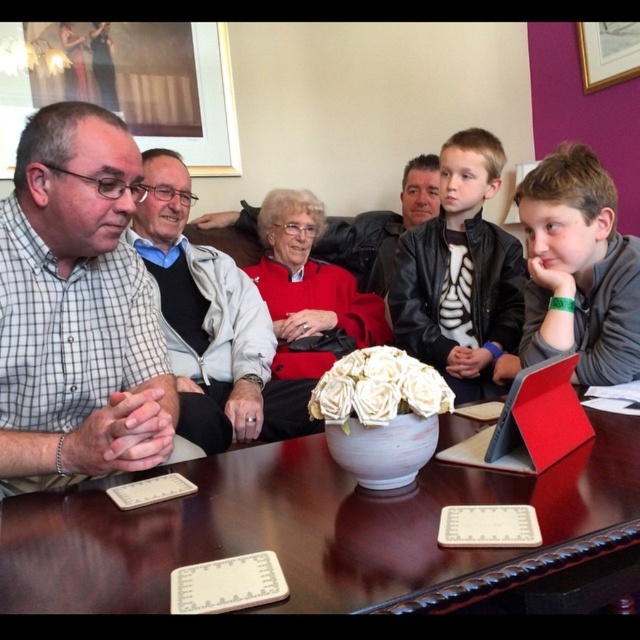
Question: Which point is farther from the camera taking this photo?

Choices:
 (A) (106, 420)
 (B) (572, 264)
 (C) (211, 324)

Answer: (C)

Question: Can you confirm if matte black laptop at center is positioned below matte black jacket at center?

Choices:
 (A) yes
 (B) no

Answer: (A)

Question: Can you confirm if checkered fabric shirt at left is bigger than matte black jacket at center?

Choices:
 (A) no
 (B) yes

Answer: (A)

Question: Can you confirm if matte black jacket at center is positioned to the right of light gray sweater at center?

Choices:
 (A) yes
 (B) no

Answer: (A)

Question: Which object appears closest to the camera in this image?

Choices:
 (A) checkered fabric shirt at left
 (B) matte black laptop at center
 (C) matte black jacket at center

Answer: (A)

Question: Which point is closer to the camera taking this photo?

Choices:
 (A) (624, 332)
 (B) (472, 356)

Answer: (A)